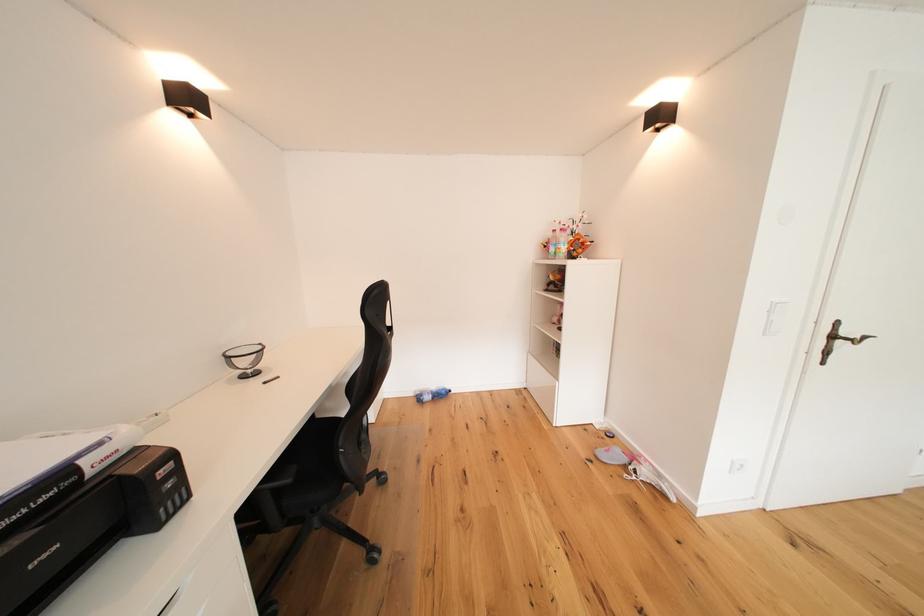
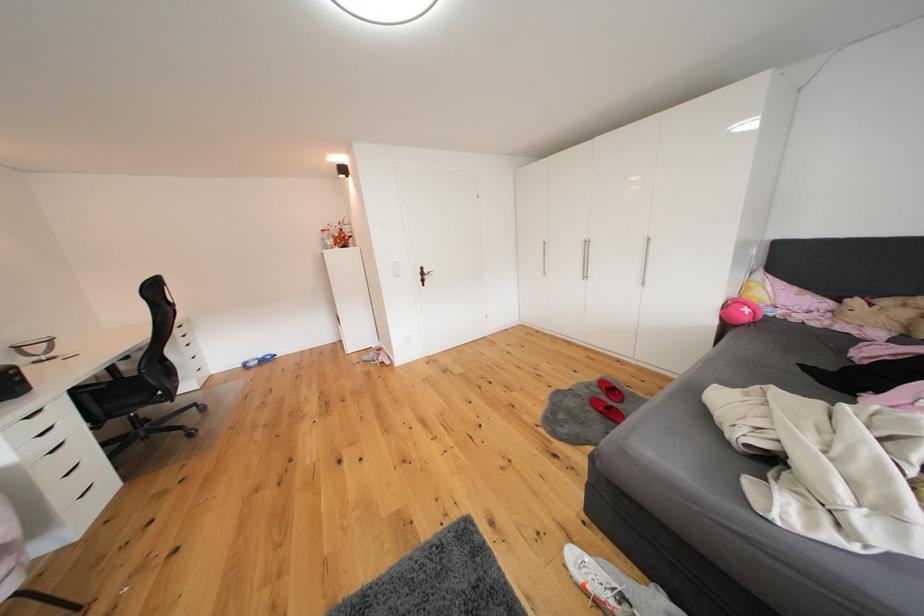
What movement of the cameraman would produce the second image?

The movement direction of the cameraman is right, backward.